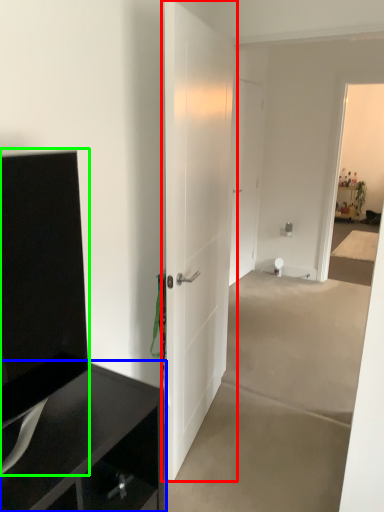
Question: Which object is the farthest from door (highlighted by a red box)? Choose among these: cabinetry (highlighted by a blue box) or tv cabinet (highlighted by a green box).

Choices:
 (A) cabinetry
 (B) tv cabinet

Answer: (B)